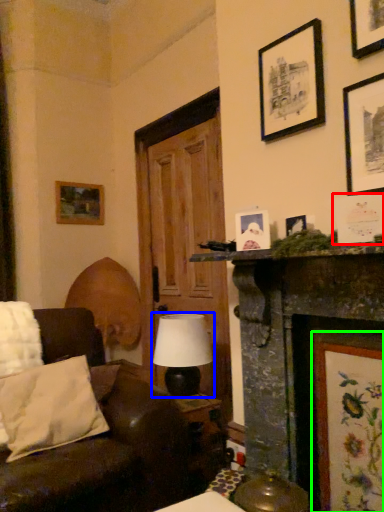
Question: Estimate the real-world distances between objects in this image. Which object is farther from picture frame (highlighted by a red box), table lamp (highlighted by a blue box) or picture frame (highlighted by a green box)?

Choices:
 (A) table lamp
 (B) picture frame

Answer: (A)